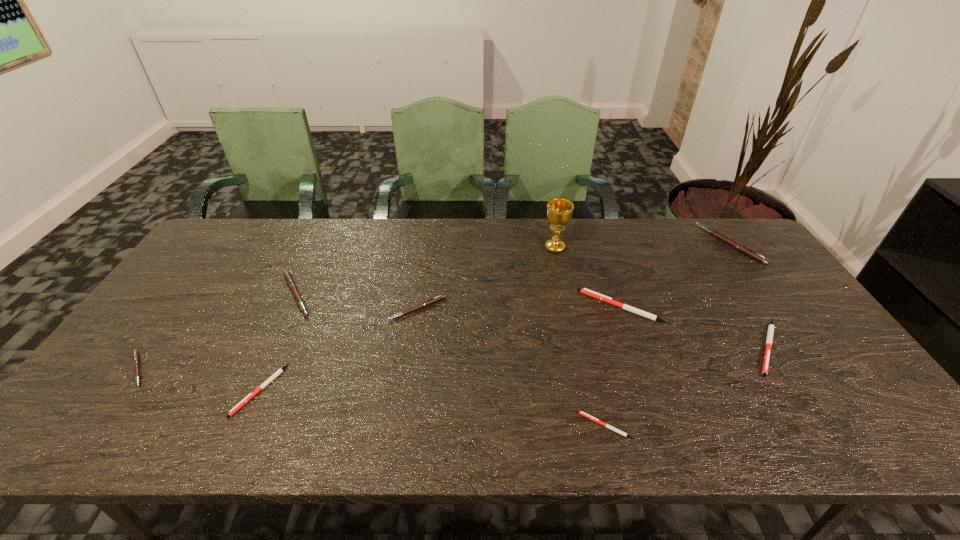
Where is `vacant region located 0.080m on the clicker of the biggest white pen`? This screenshot has width=960, height=540. vacant region located 0.080m on the clicker of the biggest white pen is located at coordinates (552, 307).

Where is `free region located on the clicker of the biggest white pen`? The image size is (960, 540). free region located on the clicker of the biggest white pen is located at coordinates (563, 307).

The image size is (960, 540). Find the location of `free location located at the nib of the sixth object from right to left`. free location located at the nib of the sixth object from right to left is located at coordinates (406, 386).

Find the location of a particular element. The width and height of the screenshot is (960, 540). free space located 0.160m on the clicker of the rightmost white pen is located at coordinates (825, 439).

At what (x,y) coordinates should I click in order to perform the action: click on vacant region located 0.300m at the nib of the leftmost pink pen. Please return your answer as a coordinate pair (x, y). This screenshot has height=540, width=960. Looking at the image, I should click on (274, 370).

At what (x,y) coordinates should I click in order to perform the action: click on vacant region located on the clicker of the shortest object. Please return your answer as a coordinate pair (x, y). Looking at the image, I should click on (542, 426).

Locate an element on the screen. The height and width of the screenshot is (540, 960). vacant space located on the clicker of the shortest object is located at coordinates (431, 426).

At what (x,y) coordinates should I click in order to perform the action: click on vacant space positioned 0.200m on the clicker of the shortest object. Please return your answer as a coordinate pair (x, y). Image resolution: width=960 pixels, height=540 pixels. Looking at the image, I should click on (489, 426).

This screenshot has width=960, height=540. In order to click on chalice located in the far edge section of the desktop in this screenshot , I will do `click(559, 210)`.

Where is `pen that is positioned at the far edge`? pen that is positioned at the far edge is located at coordinates (743, 249).